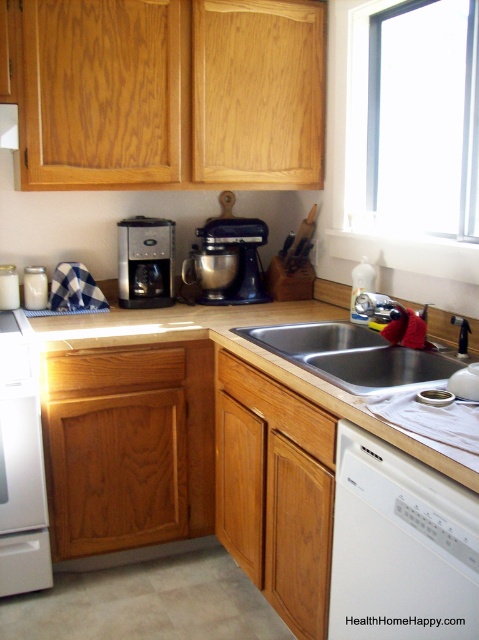
Does wooden at lower left lie in front of satin black coffee maker at center?

Yes, wooden at lower left is in front of satin black coffee maker at center.

Which is above, wooden at lower left or satin black coffee maker at center?

satin black coffee maker at center is above.

Is point (258, 308) in front of point (171, 298)?

Yes, point (258, 308) is in front of point (171, 298).

Locate an element on the screen. The image size is (479, 640). wooden at lower left is located at coordinates (248, 356).

Can you confirm if wooden at lower left is bigger than stainless steel sink at center?

Yes, wooden at lower left is bigger than stainless steel sink at center.

Measure the distance from wooden at lower left to stainless steel sink at center.

The distance of wooden at lower left from stainless steel sink at center is 9.76 inches.

Is point (178, 305) farther from camera compared to point (431, 364)?

Yes, point (178, 305) is farther from viewer.

Where is `wooden at lower left`? The image size is (479, 640). wooden at lower left is located at coordinates (248, 356).

Describe the element at coordinates (415, 116) in the screenshot. I see `transparent glass window at upper right` at that location.

Who is more distant from viewer, (352,132) or (88,340)?

The point (352,132) is more distant.

The height and width of the screenshot is (640, 479). What are the coordinates of `transparent glass window at upper right` in the screenshot? It's located at (415, 116).